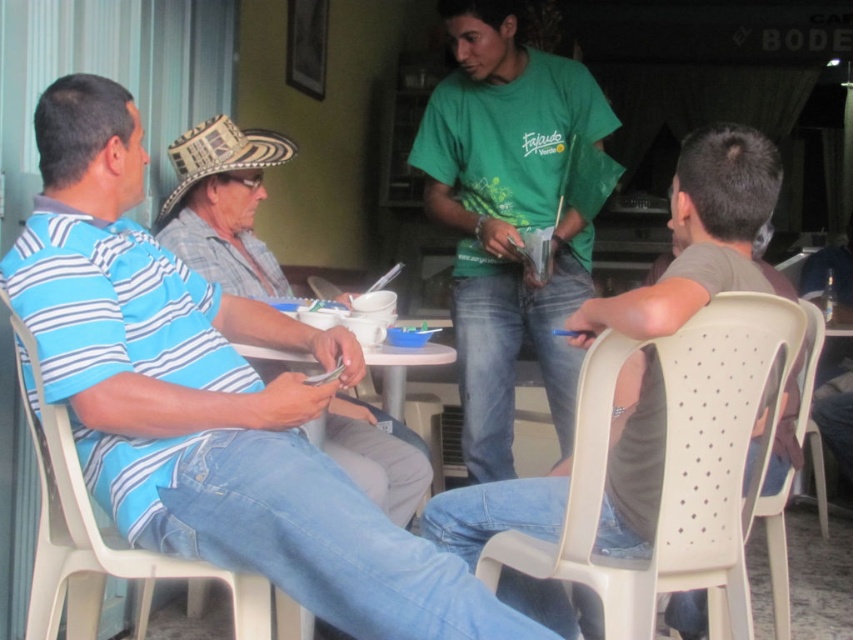
Is white plastic chair at left to the left of woven straw cowboy hat at upper left from the viewer's perspective?

Correct, you'll find white plastic chair at left to the left of woven straw cowboy hat at upper left.

Between point (160, 577) and point (189, 144), which one is positioned in front?

Point (160, 577) is more forward.

Which is behind, point (44, 538) or point (264, 161)?

The point (264, 161) is more distant.

You are a GUI agent. You are given a task and a screenshot of the screen. Output one action in this format:
    pyautogui.click(x=<x>, y=<y>)
    Task: Click on the white plastic chair at left
    
    Given the screenshot: What is the action you would take?
    pyautogui.click(x=113, y=556)

Between point (161, 216) and point (428, 433), which one is positioned behind?

The point (428, 433) is more distant.

Based on the photo, who is taller, woven straw cowboy hat at upper left or white plastic table at center?

With more height is white plastic table at center.

The width and height of the screenshot is (853, 640). Describe the element at coordinates (219, 156) in the screenshot. I see `woven straw cowboy hat at upper left` at that location.

Find the location of a particular element. woven straw cowboy hat at upper left is located at coordinates (219, 156).

Is point (209, 125) positioned behind point (62, 573)?

Yes, point (209, 125) is farther from viewer.

Is plaid fabric shirt at center bigger than white plastic chair at left?

Yes.

In order to click on plaid fabric shirt at center in this screenshot , I will do tap(223, 205).